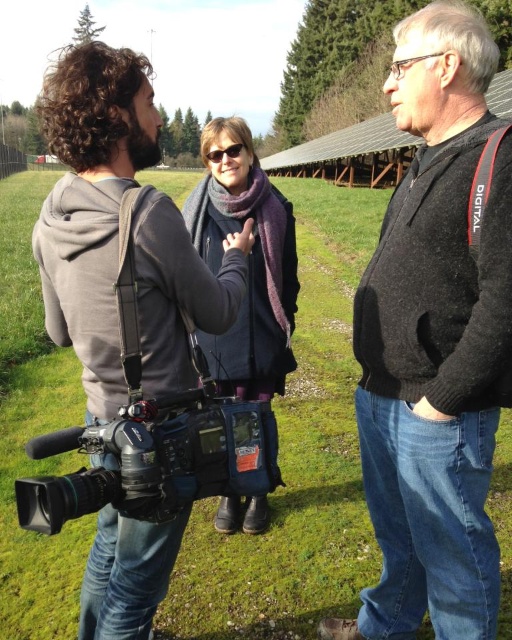
You are a photographer trying to capture a portrait of the person wearing the purple wool scarf at center. The black matte camera at lower left is in your way. Can you move the camera to the side without blocking the subject?

The black matte camera at lower left is much taller than the purple wool scarf at center, so moving it to the side might still block the view unless moved far enough away. Ensure the camera is positioned where its height doesn

You are standing at the origin point in the image and want to reach both the point at coordinates point (361, 374) and point (114, 275). Which point should you reach first to minimize the distance traveled?

To minimize the distance traveled, you should reach point (114, 275) first because it is closer to the origin than point (361, 374).